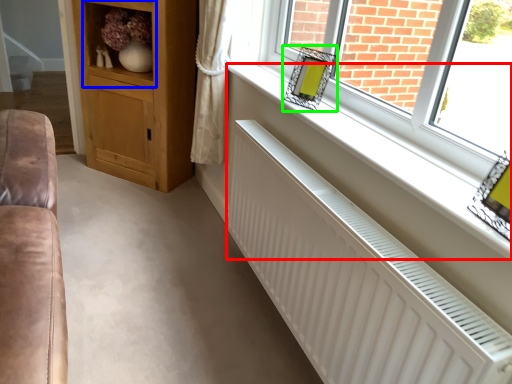
Question: Which is nearer to the window sill (highlighted by a red box)? shelf (highlighted by a blue box) or picture frame (highlighted by a green box).

Choices:
 (A) shelf
 (B) picture frame

Answer: (B)